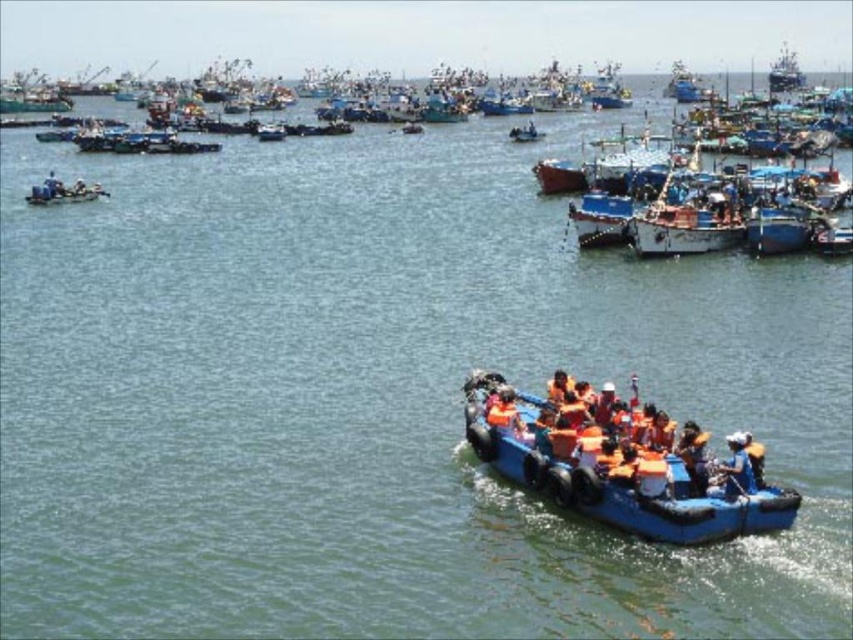
Question: Which point appears closest to the camera in this image?

Choices:
 (A) (746, 472)
 (B) (79, 193)
 (C) (705, 536)

Answer: (C)

Question: Does orange life vest at center appear on the left side of matte blue raft at left?

Choices:
 (A) no
 (B) yes

Answer: (A)

Question: Which object appears farthest from the camera in this image?

Choices:
 (A) matte blue raft at left
 (B) orange life vest at center

Answer: (A)

Question: Estimate the real-world distances between objects in this image. Which object is closer to the blue rubber boat at lower right?

Choices:
 (A) orange life vest at center
 (B) matte blue raft at left

Answer: (A)

Question: Does orange life vest at center appear under matte blue raft at left?

Choices:
 (A) yes
 (B) no

Answer: (A)

Question: Does blue rubber boat at lower right have a greater width compared to matte blue raft at left?

Choices:
 (A) no
 (B) yes

Answer: (B)